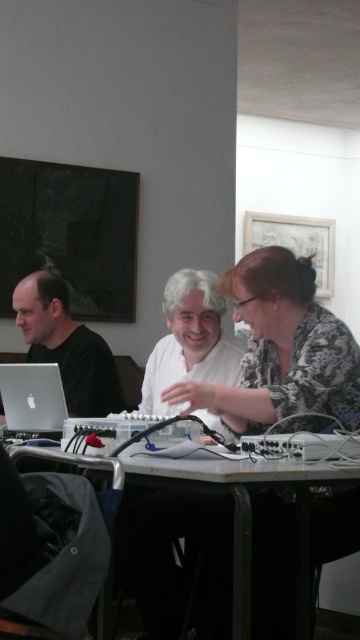
You are a guest entering the room and want to sit at the white plastic table at center. However, there is a silver metallic laptop at lower left. Can you sit there without moving the laptop?

The white plastic table at center is in front of the silver metallic laptop at lower left, so the laptop is behind the table. You can sit at the table without moving the laptop because it is already positioned behind it.

You are a photographer setting up a tripod in this scene. You need to ensure that the patterned fabric shirt at center and the silver metallic laptop at lower left are both visible in your shot. Given their relative heights, which object might require you to adjust the camera angle to include it in the frame?

The patterned fabric shirt at center is taller than the silver metallic laptop at lower left, so you might need to adjust the camera angle to include the taller patterned fabric shirt at center in the frame.